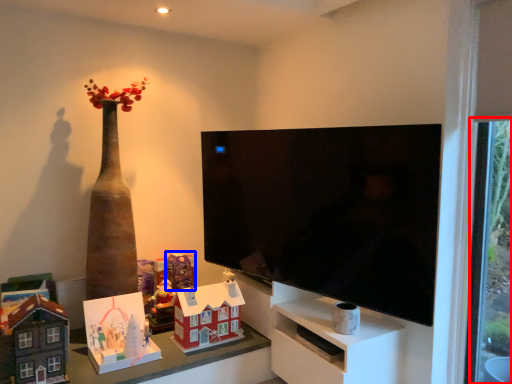
Question: Among these objects, which one is farthest to the camera, glass door (highlighted by a red box) or toy (highlighted by a blue box)?

Choices:
 (A) glass door
 (B) toy

Answer: (B)